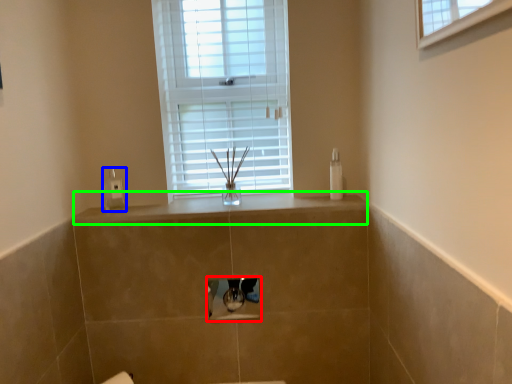
Question: Which is nearer to the medicine cabinet (highlighted by a red box)? soap dispenser (highlighted by a blue box) or counter top (highlighted by a green box).

Choices:
 (A) soap dispenser
 (B) counter top

Answer: (B)